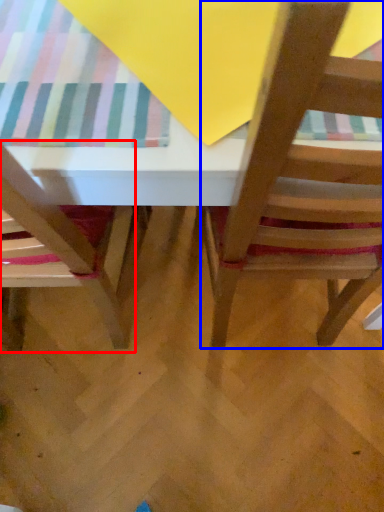
Question: Among these objects, which one is farthest to the camera, chair (highlighted by a red box) or chair (highlighted by a blue box)?

Choices:
 (A) chair
 (B) chair

Answer: (A)